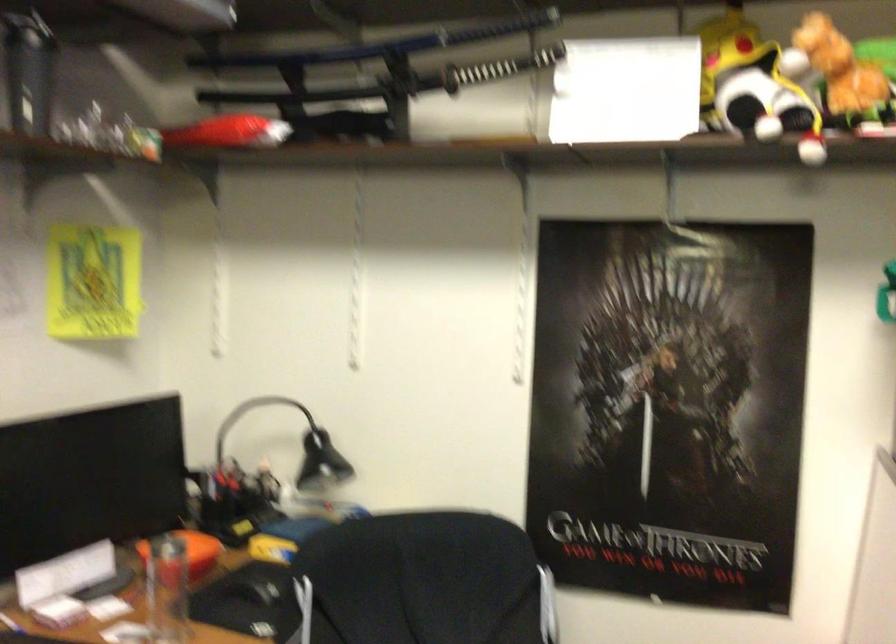
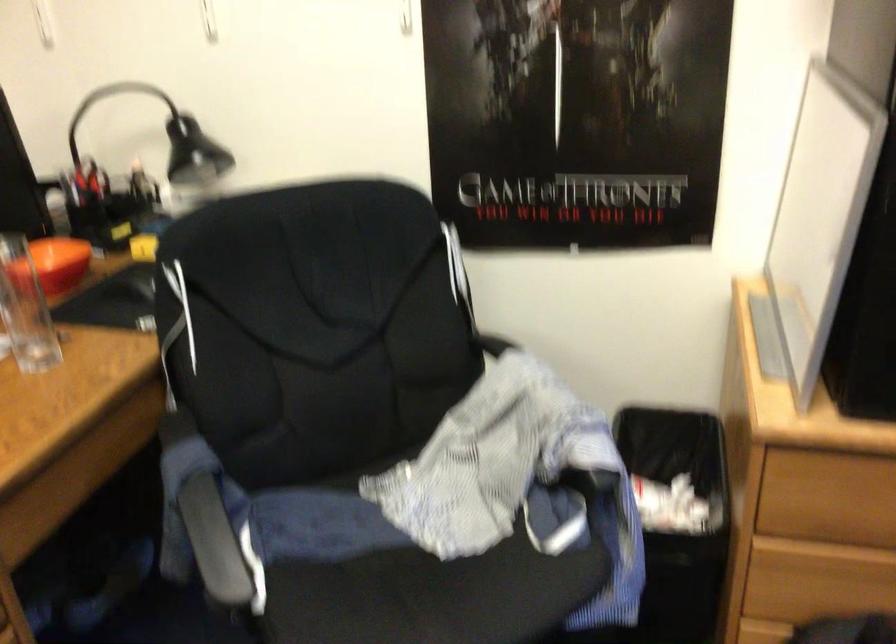
Question: Based on the continuous images, in which direction is the camera rotating? Reply with the corresponding letter.

Choices:
 (A) Left
 (B) Right
 (C) Up
 (D) Down

Answer: (D)